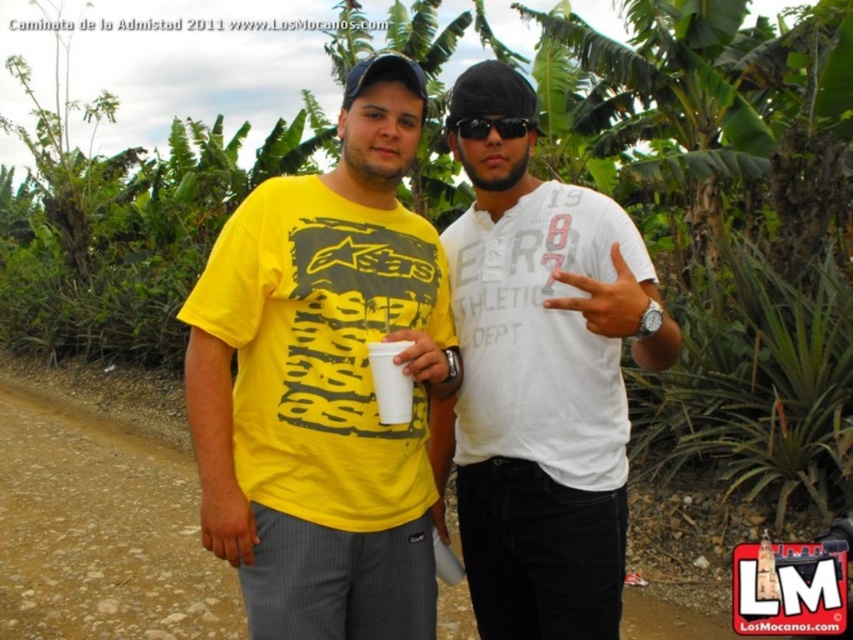
Question: Does white cotton shirt at center have a lesser width compared to black plastic sunglasses at center?

Choices:
 (A) yes
 (B) no

Answer: (B)

Question: Can you confirm if yellow matte t-shirt at center is positioned to the right of white paper cup at center?

Choices:
 (A) yes
 (B) no

Answer: (B)

Question: Which object is positioned farthest from the yellow matte t-shirt at center?

Choices:
 (A) black plastic sunglasses at center
 (B) white cotton shirt at center
 (C) white paper cup at center
 (D) brown dirt track at lower left

Answer: (D)

Question: Observing the image, what is the correct spatial positioning of yellow matte t-shirt at center in reference to brown dirt track at lower left?

Choices:
 (A) above
 (B) below

Answer: (A)

Question: Which of the following is the closest to the observer?

Choices:
 (A) (352, 520)
 (B) (85, 547)

Answer: (A)

Question: Which of these objects is positioned closest to the brown dirt track at lower left?

Choices:
 (A) yellow matte t-shirt at center
 (B) white cotton shirt at center

Answer: (A)